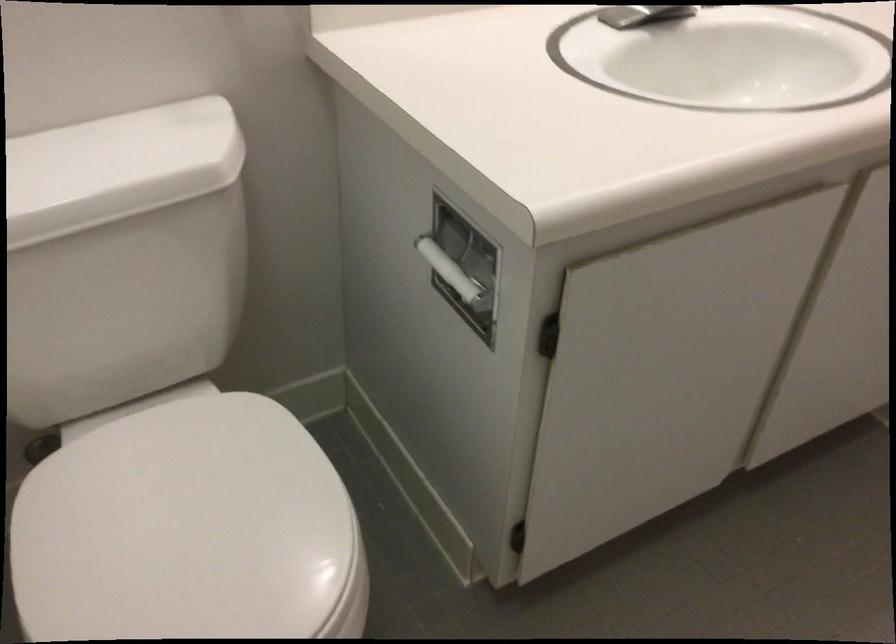
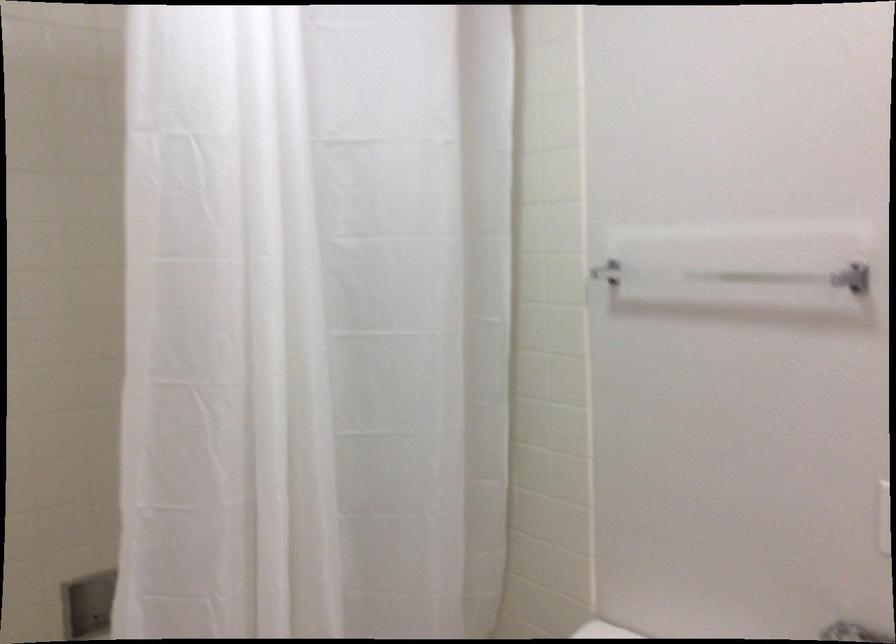
Question: How did the camera likely rotate?

Choices:
 (A) Left
 (B) Right
 (C) Up
 (D) Down

Answer: (A)